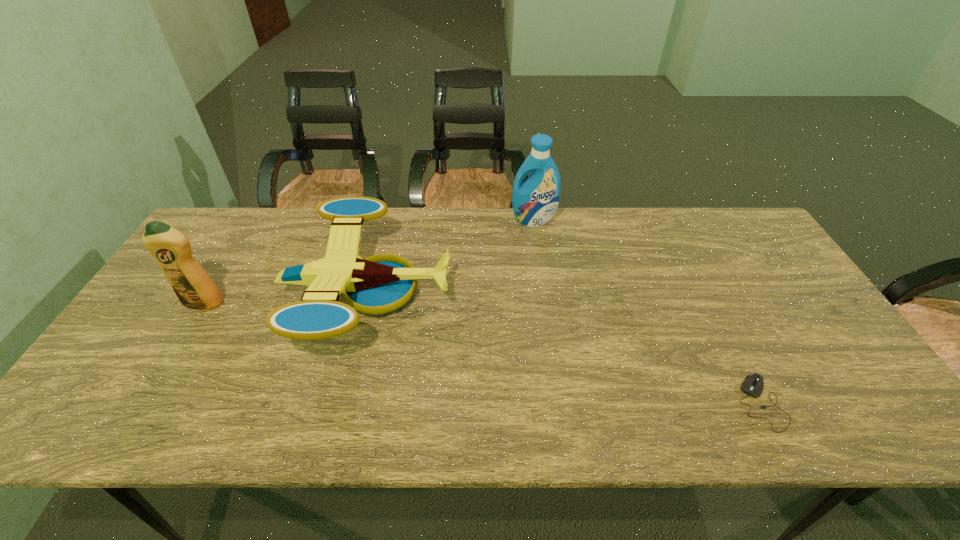
Find the location of `vacant space in between the second object from left to right and the left detergent`. vacant space in between the second object from left to right and the left detergent is located at coordinates (286, 299).

Identify the location of object that is the third closest to the third object from right to left. tap(753, 384).

Locate which object is the second closest to the farthest object. Please provide its 2D coordinates. Your answer should be formatted as a tuple, i.e. [(x, y)], where the tuple contains the x and y coordinates of a point satisfying the conditions above.

[(753, 384)]

This screenshot has width=960, height=540. I want to click on free spot that satisfies the following two spatial constraints: 1. at the cockpit of the drone; 2. on the label of the left detergent, so point(365,303).

Locate an element on the screen. The width and height of the screenshot is (960, 540). free spot that satisfies the following two spatial constraints: 1. at the cockpit of the shortest object; 2. on the right side of the third tallest object is located at coordinates (340, 402).

Where is `vacant region that satisfies the following two spatial constraints: 1. at the cockpit of the shortest object; 2. on the left side of the third tallest object`? This screenshot has width=960, height=540. vacant region that satisfies the following two spatial constraints: 1. at the cockpit of the shortest object; 2. on the left side of the third tallest object is located at coordinates (340, 402).

Image resolution: width=960 pixels, height=540 pixels. I want to click on free spot that satisfies the following two spatial constraints: 1. on the front-facing side of the farthest object; 2. at the cockpit of the second shortest object, so click(x=544, y=294).

What are the coordinates of `free point that satisfies the following two spatial constraints: 1. at the cockpit of the third tallest object; 2. on the label of the left detergent` in the screenshot? It's located at (365, 303).

The height and width of the screenshot is (540, 960). I want to click on vacant region that satisfies the following two spatial constraints: 1. at the cockpit of the third tallest object; 2. on the left side of the nearest object, so click(340, 402).

You are a GUI agent. You are given a task and a screenshot of the screen. Output one action in this format:
    pyautogui.click(x=<x>, y=<y>)
    Task: Click on the vacant space that satisfies the following two spatial constraints: 1. on the front-facing side of the second object from right to left; 2. at the cockpit of the third object from right to left
    The height and width of the screenshot is (540, 960).
    Given the screenshot: What is the action you would take?
    pyautogui.click(x=544, y=294)